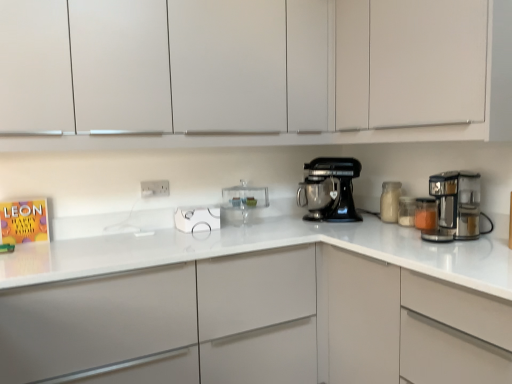
This screenshot has height=384, width=512. What do you see at coordinates (406, 211) in the screenshot? I see `translucent glass jar at right, placed as the 3th kitchen appliance when sorted from left to right` at bounding box center [406, 211].

This screenshot has width=512, height=384. What do you see at coordinates (155, 188) in the screenshot?
I see `white plastic electric outlet at center` at bounding box center [155, 188].

The width and height of the screenshot is (512, 384). What do you see at coordinates (298, 78) in the screenshot?
I see `white matte cabinet at upper center, positioned as the second cabinetry in top-to-bottom order` at bounding box center [298, 78].

This screenshot has width=512, height=384. I want to click on translucent glass jar at right, which ranks as the second kitchen appliance in right-to-left order, so click(406, 211).

From the image's perspective, is translucent glass jar at right, positioned as the first kitchen appliance in right-to-left order, above or below transparent glass cake stand at center, which is counted as the fourth kitchen appliance, starting from the right?

Clearly, from the image's perspective, translucent glass jar at right, positioned as the first kitchen appliance in right-to-left order, is below transparent glass cake stand at center, which is counted as the fourth kitchen appliance, starting from the right.

Is translucent glass jar at right, positioned as the first kitchen appliance in right-to-left order, facing away from transparent glass cake stand at center, acting as the first kitchen appliance starting from the left?

No, translucent glass jar at right, positioned as the first kitchen appliance in right-to-left order,'s orientation is not away from transparent glass cake stand at center, acting as the first kitchen appliance starting from the left.

Looking at this image, would you say translucent glass jar at right, positioned as the first kitchen appliance in right-to-left order, is a long distance from transparent glass cake stand at center, which is counted as the fourth kitchen appliance, starting from the right?

No, translucent glass jar at right, positioned as the first kitchen appliance in right-to-left order, is not far from transparent glass cake stand at center, which is counted as the fourth kitchen appliance, starting from the right.

Based on the photo, which is closer to the camera, (441, 223) or (256, 198)?

Clearly, point (441, 223) is closer to the camera than point (256, 198).

Looking at their sizes, would you say satin silver coffee maker at right is wider or thinner than transparent glass cake stand at center, acting as the first kitchen appliance starting from the left?

Considering their sizes, satin silver coffee maker at right looks broader than transparent glass cake stand at center, acting as the first kitchen appliance starting from the left.

Looking at this image, relative to transparent glass cake stand at center, which is counted as the fourth kitchen appliance, starting from the right, is satin silver coffee maker at right in front or behind?

Clearly, satin silver coffee maker at right is in front of transparent glass cake stand at center, which is counted as the fourth kitchen appliance, starting from the right.

Considering the positions of objects satin silver coffee maker at right and transparent glass cake stand at center, acting as the first kitchen appliance starting from the left, in the image provided, who is more to the right, satin silver coffee maker at right or transparent glass cake stand at center, acting as the first kitchen appliance starting from the left,?

satin silver coffee maker at right is more to the right.

From the image's perspective, would you say white matte cabinet at upper center, positioned as the second cabinetry in top-to-bottom order, is shown under white plastic electric outlet at center?

No, from the image's perspective, white matte cabinet at upper center, positioned as the second cabinetry in top-to-bottom order, is not beneath white plastic electric outlet at center.

Between white matte cabinet at upper center, marked as the 2th cabinetry in a bottom-to-top arrangement, and white plastic electric outlet at center, which one has smaller width?

white plastic electric outlet at center is thinner.

Between white matte cabinet at upper center, marked as the 2th cabinetry in a bottom-to-top arrangement, and white plastic electric outlet at center, which one has larger size?

white matte cabinet at upper center, marked as the 2th cabinetry in a bottom-to-top arrangement.

Is white matte cabinet at upper center, positioned as the second cabinetry in top-to-bottom order, to the right of white plastic electric outlet at center from the viewer's perspective?

Correct, you'll find white matte cabinet at upper center, positioned as the second cabinetry in top-to-bottom order, to the right of white plastic electric outlet at center.

Is transparent glass cake stand at center, which is counted as the fourth kitchen appliance, starting from the right, directly adjacent to white glass jar at right, marked as the 2th kitchen appliance in a left-to-right arrangement?

There is a gap between transparent glass cake stand at center, which is counted as the fourth kitchen appliance, starting from the right, and white glass jar at right, marked as the 2th kitchen appliance in a left-to-right arrangement.

From a real-world perspective, is transparent glass cake stand at center, which is counted as the fourth kitchen appliance, starting from the right, above or below white glass jar at right, marked as the 2th kitchen appliance in a left-to-right arrangement?

Clearly, from a real-world perspective, transparent glass cake stand at center, which is counted as the fourth kitchen appliance, starting from the right, is above white glass jar at right, marked as the 2th kitchen appliance in a left-to-right arrangement.

Could you tell me if transparent glass cake stand at center, acting as the first kitchen appliance starting from the left, is facing white glass jar at right, marked as the 2th kitchen appliance in a left-to-right arrangement?

No, transparent glass cake stand at center, acting as the first kitchen appliance starting from the left, does not turn towards white glass jar at right, marked as the 2th kitchen appliance in a left-to-right arrangement.

Is white matte cabinet at upper center, the third cabinetry when ordered from bottom to top, next to white plastic electric outlet at center and touching it?

They are not placed beside each other.

Does white matte cabinet at upper center, the third cabinetry when ordered from bottom to top, have a lesser width compared to white plastic electric outlet at center?

No, white matte cabinet at upper center, the third cabinetry when ordered from bottom to top, is not thinner than white plastic electric outlet at center.

Measure the distance from white matte cabinet at upper center, the third cabinetry when ordered from bottom to top, to white plastic electric outlet at center.

They are 1.30 meters apart.

You are a GUI agent. You are given a task and a screenshot of the screen. Output one action in this format:
    pyautogui.click(x=<x>, y=<y>)
    Task: Click on the 1st cabinetry in front of the white plastic electric outlet at center, starting your count from the anchor
    The width and height of the screenshot is (512, 384).
    Given the screenshot: What is the action you would take?
    pyautogui.click(x=410, y=62)

Could you tell me if satin silver coffee maker at right is facing white matte cabinet at upper center, acting as the first cabinetry starting from the top?

No, satin silver coffee maker at right is not turned towards white matte cabinet at upper center, acting as the first cabinetry starting from the top.

Which of these two, satin silver coffee maker at right or white matte cabinet at upper center, acting as the first cabinetry starting from the top, is bigger?

white matte cabinet at upper center, acting as the first cabinetry starting from the top.

From the image's perspective, which one is positioned higher, satin silver coffee maker at right or white matte cabinet at upper center, acting as the first cabinetry starting from the top?

From the image's view, white matte cabinet at upper center, acting as the first cabinetry starting from the top, is above.

Is satin silver coffee maker at right spatially inside white matte cabinet at upper center, the third cabinetry when ordered from bottom to top, or outside of it?

satin silver coffee maker at right lies outside white matte cabinet at upper center, the third cabinetry when ordered from bottom to top.

Locate an element on the screen. This screenshot has height=384, width=512. home appliance to the left of translucent glass jar at right, positioned as the first kitchen appliance in right-to-left order is located at coordinates (330, 189).

Measure the distance between black metallic stand mixer at center and translucent glass jar at right, arranged as the 4th kitchen appliance when viewed from the left.

black metallic stand mixer at center and translucent glass jar at right, arranged as the 4th kitchen appliance when viewed from the left, are 20.12 inches apart from each other.

From a real-world perspective, is black metallic stand mixer at center located beneath translucent glass jar at right, positioned as the first kitchen appliance in right-to-left order?

No.

Is black metallic stand mixer at center not within translucent glass jar at right, arranged as the 4th kitchen appliance when viewed from the left?

Yes, black metallic stand mixer at center is not within translucent glass jar at right, arranged as the 4th kitchen appliance when viewed from the left.

What are the coordinates of `the 2nd kitchen appliance in front of the transparent glass cake stand at center, acting as the first kitchen appliance starting from the left, starting your count from the anchor` in the screenshot? It's located at (425, 213).

Where is `the 1st kitchen appliance positioned above the satin silver coffee maker at right (from the image's perspective)`? Image resolution: width=512 pixels, height=384 pixels. the 1st kitchen appliance positioned above the satin silver coffee maker at right (from the image's perspective) is located at coordinates (242, 202).

Considering their positions, is translucent glass jar at right, positioned as the first kitchen appliance in right-to-left order, positioned further to translucent glass jar at right, placed as the 3th kitchen appliance when sorted from left to right, than satin silver coffee maker at right?

Based on the image, satin silver coffee maker at right appears to be further to translucent glass jar at right, placed as the 3th kitchen appliance when sorted from left to right.

Estimate the real-world distances between objects in this image. Which object is further from transparent glass cake stand at center, acting as the first kitchen appliance starting from the left, black metallic stand mixer at center or translucent glass jar at right, placed as the 3th kitchen appliance when sorted from left to right?

translucent glass jar at right, placed as the 3th kitchen appliance when sorted from left to right, is further to transparent glass cake stand at center, acting as the first kitchen appliance starting from the left.

Which object lies nearer to the anchor point satin silver coffee maker at right, translucent glass jar at right, which ranks as the second kitchen appliance in right-to-left order, or transparent glass cake stand at center, which is counted as the fourth kitchen appliance, starting from the right?

translucent glass jar at right, which ranks as the second kitchen appliance in right-to-left order.

Based on their spatial positions, is white matte cabinet at upper center, positioned as the second cabinetry in top-to-bottom order, or satin silver coffee maker at right further from white matte cabinet at center, the first cabinetry in the bottom-to-top sequence?

The object further to white matte cabinet at center, the first cabinetry in the bottom-to-top sequence, is white matte cabinet at upper center, positioned as the second cabinetry in top-to-bottom order.

From the image, which object appears to be farther from transparent glass cake stand at center, which is counted as the fourth kitchen appliance, starting from the right, translucent glass jar at right, arranged as the 4th kitchen appliance when viewed from the left, or white plastic electric outlet at center?

translucent glass jar at right, arranged as the 4th kitchen appliance when viewed from the left.

From the image, which object appears to be nearer to white matte cabinet at center, marked as the 3th cabinetry in a top-to-bottom arrangement, black metallic stand mixer at center or translucent glass jar at right, positioned as the first kitchen appliance in right-to-left order?

black metallic stand mixer at center.

Based on their spatial positions, is white matte cabinet at upper center, marked as the 2th cabinetry in a bottom-to-top arrangement, or translucent glass jar at right, arranged as the 4th kitchen appliance when viewed from the left, closer to white glass jar at right, marked as the 2th kitchen appliance in a left-to-right arrangement?

The object closer to white glass jar at right, marked as the 2th kitchen appliance in a left-to-right arrangement, is translucent glass jar at right, arranged as the 4th kitchen appliance when viewed from the left.

Considering their positions, is white glass jar at right, which ranks as the third kitchen appliance in right-to-left order, positioned further to white plastic electric outlet at center than translucent glass jar at right, which ranks as the second kitchen appliance in right-to-left order?

Based on the image, translucent glass jar at right, which ranks as the second kitchen appliance in right-to-left order, appears to be further to white plastic electric outlet at center.

Locate an element on the screen. Image resolution: width=512 pixels, height=384 pixels. home appliance between white plastic electric outlet at center and white glass jar at right, which ranks as the third kitchen appliance in right-to-left order is located at coordinates (330, 189).

This screenshot has width=512, height=384. I want to click on mixer that lies between white matte cabinet at upper center, acting as the first cabinetry starting from the top, and translucent glass jar at right, placed as the 3th kitchen appliance when sorted from left to right, from top to bottom, so [456, 207].

Identify the location of home appliance situated between white plastic electric outlet at center and white matte cabinet at upper center, the third cabinetry when ordered from bottom to top, from left to right. (330, 189).

In order to click on home appliance situated between white plastic electric outlet at center and translucent glass jar at right, which ranks as the second kitchen appliance in right-to-left order, from left to right in this screenshot , I will do `click(330, 189)`.